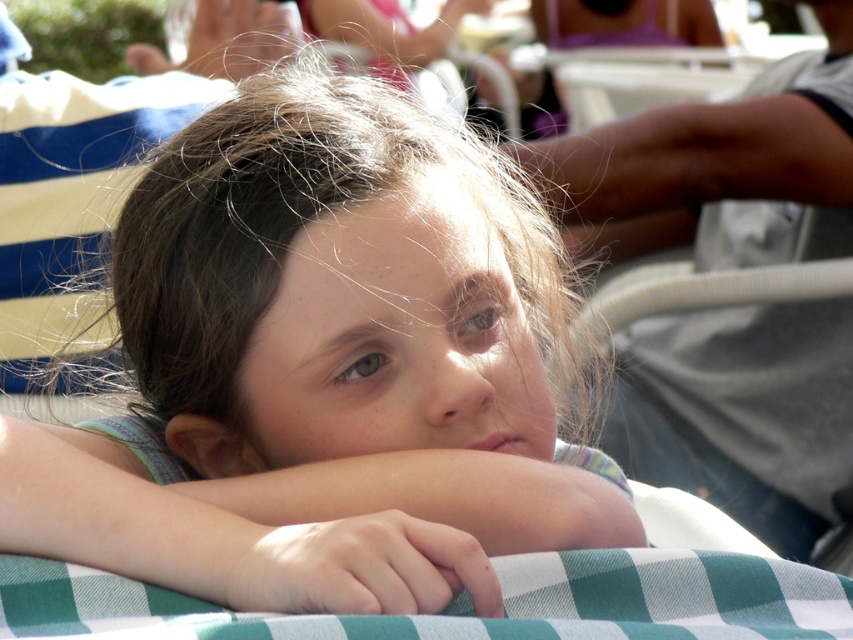
Between point (241, 196) and point (381, 550), which one is positioned in front?

Positioned in front is point (381, 550).

Who is more distant from viewer, (234,173) or (155,502)?

The point (234,173) is behind.

The image size is (853, 640). Identify the location of smooth skin child at center. point(315,380).

Is smooth skin arm at lower center below green checkered fabric at center?

No.

Image resolution: width=853 pixels, height=640 pixels. Describe the element at coordinates (221, 536) in the screenshot. I see `smooth skin arm at lower center` at that location.

Identify the location of smooth skin arm at lower center. (221, 536).

Which of these two, smooth skin child at center or green checkered fabric at center, stands shorter?

green checkered fabric at center

Who is lower down, smooth skin child at center or green checkered fabric at center?

green checkered fabric at center

You are a GUI agent. You are given a task and a screenshot of the screen. Output one action in this format:
    pyautogui.click(x=<x>, y=<y>)
    Task: Click on the smooth skin child at center
    
    Given the screenshot: What is the action you would take?
    pyautogui.click(x=315, y=380)

Where is `smooth skin child at center`? smooth skin child at center is located at coordinates (315, 380).